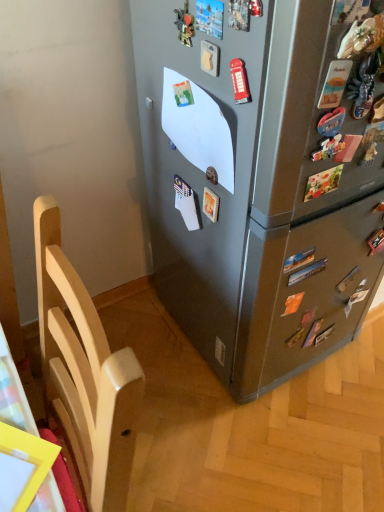
Question: Is point (365, 37) positioned closer to the camera than point (127, 478)?

Choices:
 (A) farther
 (B) closer

Answer: (A)

Question: Is satin gray refrigerator at center situated inside light wood chair at left or outside?

Choices:
 (A) inside
 (B) outside

Answer: (B)

Question: In terms of size, does satin gray refrigerator at center appear bigger or smaller than light wood chair at left?

Choices:
 (A) big
 (B) small

Answer: (A)

Question: Does point (57, 412) appear closer or farther from the camera than point (205, 338)?

Choices:
 (A) farther
 (B) closer

Answer: (B)

Question: In terms of size, does light wood chair at left appear bigger or smaller than satin gray refrigerator at center?

Choices:
 (A) small
 (B) big

Answer: (A)

Question: From the image's perspective, is light wood chair at left located above or below satin gray refrigerator at center?

Choices:
 (A) above
 (B) below

Answer: (B)

Question: Is light wood chair at left in front of or behind satin gray refrigerator at center in the image?

Choices:
 (A) behind
 (B) front

Answer: (B)